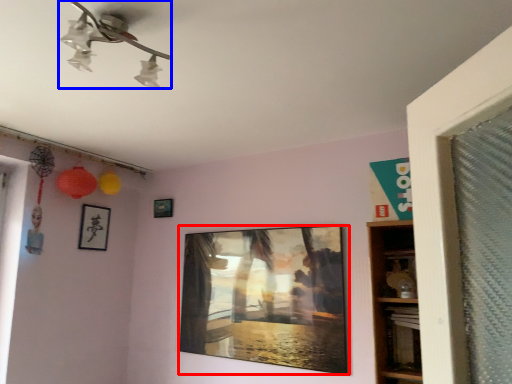
Question: Which object is further to the camera taking this photo, picture frame (highlighted by a red box) or lamp (highlighted by a blue box)?

Choices:
 (A) picture frame
 (B) lamp

Answer: (A)